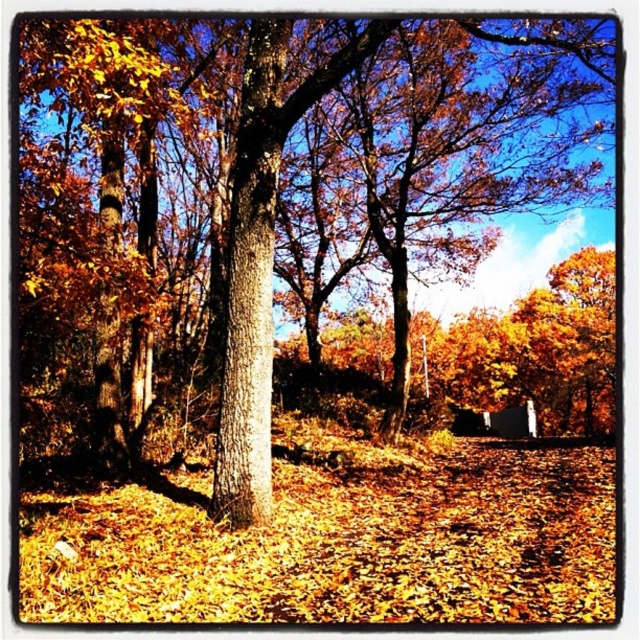
In the scene shown: You are standing at the center of the scene and want to find the smooth bark tree at center. Which direction should you look to locate it?

The smooth bark tree at center is located at point coordinates of (269, 214), so you should look towards the center of the scene to find it.

You are standing in the autumnal scene and want to take a photo of both the smooth bark tree at center and the smooth brown tree trunk at center. Which tree should you position yourself to the left of to capture both in the frame?

You should position yourself to the left of the smooth brown tree trunk at center because the smooth bark tree at center is on its right side, allowing both trees to be captured in the frame when positioned this way.